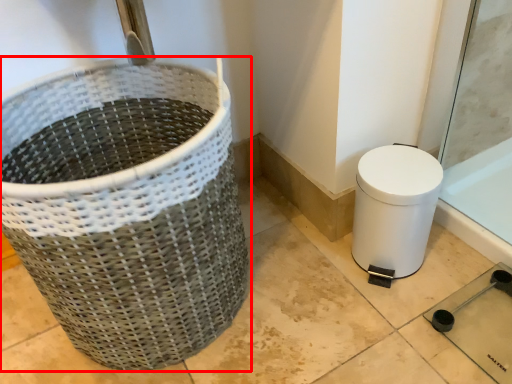
Question: Where is waste container (annotated by the red box) located in relation to toilet bowl in the image?

Choices:
 (A) left
 (B) right

Answer: (A)